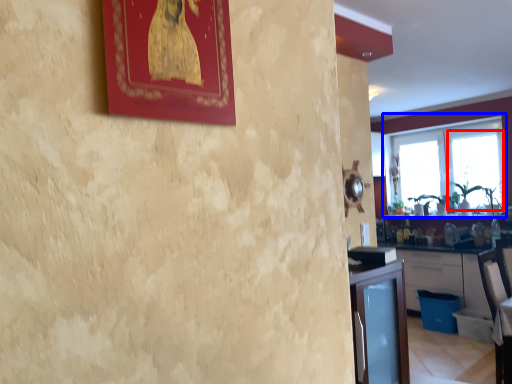
Question: Which object is closer to the camera taking this photo, window screen (highlighted by a red box) or window (highlighted by a blue box)?

Choices:
 (A) window screen
 (B) window

Answer: (B)